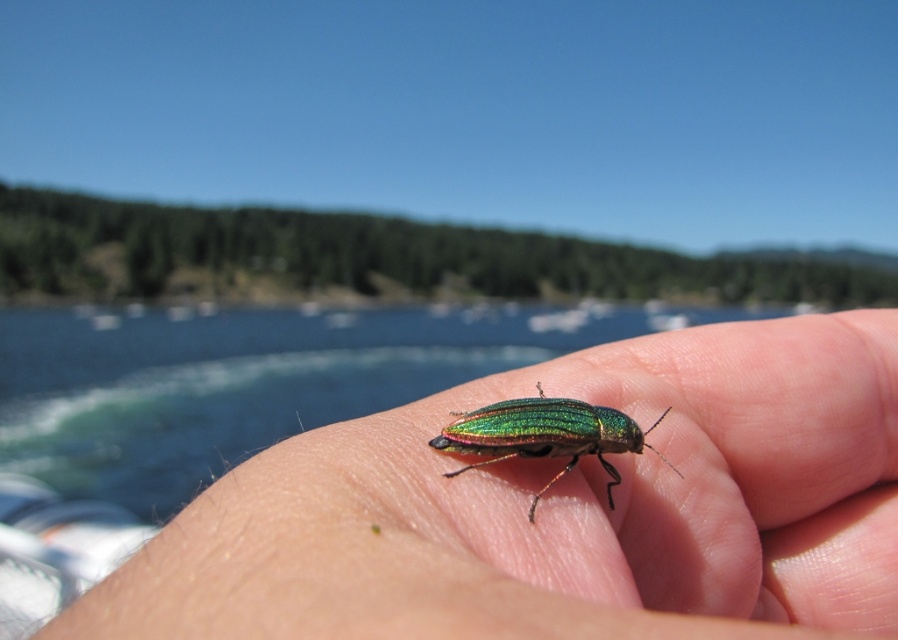
Can you confirm if metallic green beetle at center is bigger than metallic iridescent beetle at center?

Yes, metallic green beetle at center is bigger than metallic iridescent beetle at center.

Between metallic green beetle at center and metallic iridescent beetle at center, which one has more height?

Standing taller between the two is metallic green beetle at center.

This screenshot has height=640, width=898. Find the location of `metallic green beetle at center`. metallic green beetle at center is located at coordinates (561, 509).

Find the location of a particular element. metallic green beetle at center is located at coordinates (561, 509).